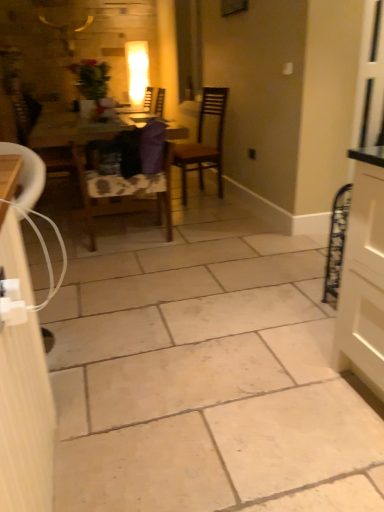
Measure the distance between point (61, 126) and camera.

A distance of 10.82 feet exists between point (61, 126) and camera.

Measure the distance between point [69,133] and camera.

Point [69,133] is 10.16 feet from camera.

The height and width of the screenshot is (512, 384). What do you see at coordinates (73, 131) in the screenshot? I see `wooden table at center` at bounding box center [73, 131].

Measure the distance between white glossy cabinet at left and camera.

The distance of white glossy cabinet at left from camera is 27.99 inches.

Identify the location of white glossy cabinet at left. (25, 420).

Identify the location of wooden chair at left, the third chair in the right-to-left sequence. (43, 139).

Which object is further away from the camera, brown wooden chair at center, which is the third chair from left to right, or white glossy cabinet at left?

brown wooden chair at center, which is the third chair from left to right, is further away from the camera.

Measure the distance from brown wooden chair at center, which is counted as the 1th chair, starting from the right, to white glossy cabinet at left.

brown wooden chair at center, which is counted as the 1th chair, starting from the right, is 9.03 feet from white glossy cabinet at left.

From a real-world perspective, is brown wooden chair at center, which is counted as the 1th chair, starting from the right, over white glossy cabinet at left?

Correct, in the physical world, brown wooden chair at center, which is counted as the 1th chair, starting from the right, is higher than white glossy cabinet at left.

Image resolution: width=384 pixels, height=512 pixels. What are the coordinates of `cabinetry that appears below the brown wooden chair at center, which is the third chair from left to right (from the image's perspective)` in the screenshot? It's located at coord(25,420).

Can you confirm if wooden table at center is bigger than wooden chair at center, arranged as the second chair when viewed from the right?

Yes.

Would you say wooden table at center is inside or outside wooden chair at center, arranged as the second chair when viewed from the right?

wooden table at center lies outside wooden chair at center, arranged as the second chair when viewed from the right.

Is wooden table at center turned away from wooden chair at center, which is the 2th chair from left to right?

wooden table at center is not turned away from wooden chair at center, which is the 2th chair from left to right.

Is wooden table at center at the right side of wooden chair at center, which is the 2th chair from left to right?

No.

Which is closer to the camera, [112,133] or [30,108]?

Point [112,133].

This screenshot has height=512, width=384. In order to click on chair that is the 1st one above the wooden table at center (from a real-world perspective) in this screenshot , I will do `click(43, 139)`.

Is wooden table at center oriented away from wooden chair at left, the third chair in the right-to-left sequence?

No, wooden table at center's orientation is not away from wooden chair at left, the third chair in the right-to-left sequence.

Would you say wooden table at center is outside wooden chair at left, the third chair in the right-to-left sequence?

That's correct, wooden table at center is outside of wooden chair at left, the third chair in the right-to-left sequence.

From the image's perspective, which one is positioned lower, wooden chair at center, which is the 2th chair from left to right, or wooden table at center?

wooden chair at center, which is the 2th chair from left to right.

Are wooden chair at center, which is the 2th chair from left to right, and wooden table at center far apart?

No, wooden chair at center, which is the 2th chair from left to right, is not far away from wooden table at center.

From a real-world perspective, which object rests below the other?

In real-world perspective, wooden chair at center, arranged as the second chair when viewed from the right, is lower.

From the image's perspective, count 2nd chairs upward from the wooden chair at center, which is the 2th chair from left to right, and point to it. Please provide its 2D coordinates.

[(204, 141)]

Are brown wooden chair at center, which is counted as the 1th chair, starting from the right, and wooden chair at center, arranged as the second chair when viewed from the right, located far from each other?

brown wooden chair at center, which is counted as the 1th chair, starting from the right, is positioned a significant distance from wooden chair at center, arranged as the second chair when viewed from the right.

Can you confirm if white glossy cabinet at left is shorter than wooden table at center?

Incorrect, the height of white glossy cabinet at left does not fall short of that of wooden table at center.

Relative to wooden table at center, is white glossy cabinet at left in front or behind?

Visually, white glossy cabinet at left is located in front of wooden table at center.

From a real-world perspective, relative to wooden table at center, is white glossy cabinet at left vertically above or below?

Clearly, from a real-world perspective, white glossy cabinet at left is above wooden table at center.

At what (x,y) coordinates should I click in order to perform the action: click on cabinetry in front of the wooden table at center. Please return your answer as a coordinate pair (x, y). The height and width of the screenshot is (512, 384). Looking at the image, I should click on (25, 420).

From the image's perspective, which is above, white glossy cabinet at left or wooden chair at left, marked as the 1th chair in a left-to-right arrangement?

wooden chair at left, marked as the 1th chair in a left-to-right arrangement, from the image's perspective.

Could you measure the distance between white glossy cabinet at left and wooden chair at left, marked as the 1th chair in a left-to-right arrangement?

white glossy cabinet at left and wooden chair at left, marked as the 1th chair in a left-to-right arrangement, are 7.36 feet apart from each other.

Is white glossy cabinet at left bigger than wooden chair at left, the third chair in the right-to-left sequence?

Incorrect, white glossy cabinet at left is not larger than wooden chair at left, the third chair in the right-to-left sequence.

Which is more to the right, white glossy cabinet at left or wooden chair at left, marked as the 1th chair in a left-to-right arrangement?

white glossy cabinet at left is more to the right.

I want to click on the 2nd chair to the right of the white glossy cabinet at left, counting from the anchor's position, so click(x=204, y=141).

This screenshot has width=384, height=512. Identify the location of chair in front of the wooden table at center. (131, 181).

Based on their spatial positions, is wooden table at center or brown wooden chair at center, which is counted as the 1th chair, starting from the right, further from wooden chair at center, arranged as the second chair when viewed from the right?

brown wooden chair at center, which is counted as the 1th chair, starting from the right.

Looking at the image, which one is located further to white glossy cabinet at left, brown wooden chair at center, which is the third chair from left to right, or wooden table at center?

brown wooden chair at center, which is the third chair from left to right, is positioned further to the anchor white glossy cabinet at left.

Based on the photo, considering their positions, is brown wooden chair at center, which is counted as the 1th chair, starting from the right, positioned closer to wooden chair at left, marked as the 1th chair in a left-to-right arrangement, than wooden chair at center, which is the 2th chair from left to right?

wooden chair at center, which is the 2th chair from left to right, lies closer to wooden chair at left, marked as the 1th chair in a left-to-right arrangement, than the other object.

When comparing their distances from wooden table at center, does brown wooden chair at center, which is the third chair from left to right, or wooden chair at left, marked as the 1th chair in a left-to-right arrangement, seem closer?

The object closer to wooden table at center is wooden chair at left, marked as the 1th chair in a left-to-right arrangement.

When comparing their distances from wooden table at center, does brown wooden chair at center, which is the third chair from left to right, or white glossy cabinet at left seem further?

white glossy cabinet at left is positioned further to the anchor wooden table at center.

From the picture: Based on their spatial positions, is brown wooden chair at center, which is counted as the 1th chair, starting from the right, or wooden table at center closer to wooden chair at center, which is the 2th chair from left to right?

The object closer to wooden chair at center, which is the 2th chair from left to right, is wooden table at center.

When comparing their distances from white glossy cabinet at left, does brown wooden chair at center, which is the third chair from left to right, or wooden chair at center, arranged as the second chair when viewed from the right, seem further?

brown wooden chair at center, which is the third chair from left to right, is further to white glossy cabinet at left.

From the image, which object appears to be farther from white glossy cabinet at left, wooden chair at center, arranged as the second chair when viewed from the right, or brown wooden chair at center, which is the third chair from left to right?

brown wooden chair at center, which is the third chair from left to right, lies further to white glossy cabinet at left than the other object.

Image resolution: width=384 pixels, height=512 pixels. In order to click on table between white glossy cabinet at left and brown wooden chair at center, which is counted as the 1th chair, starting from the right, in the front-back direction in this screenshot , I will do `click(73, 131)`.

Where is `chair between white glossy cabinet at left and wooden table at center along the z-axis`? This screenshot has width=384, height=512. chair between white glossy cabinet at left and wooden table at center along the z-axis is located at coordinates (131, 181).

Find the location of a particular element. The width and height of the screenshot is (384, 512). table between white glossy cabinet at left and wooden chair at left, marked as the 1th chair in a left-to-right arrangement, from front to back is located at coordinates (73, 131).

At what (x,y) coordinates should I click in order to perform the action: click on chair between wooden chair at left, marked as the 1th chair in a left-to-right arrangement, and brown wooden chair at center, which is the third chair from left to right. Please return your answer as a coordinate pair (x, y). This screenshot has height=512, width=384. Looking at the image, I should click on (131, 181).